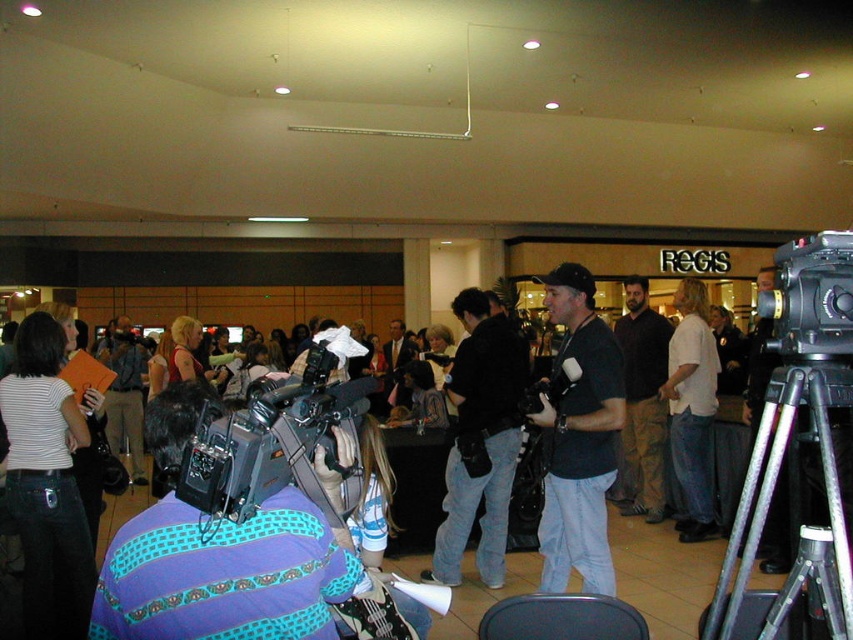
Question: Which of the following is the closest to the observer?

Choices:
 (A) (611, 474)
 (B) (776, 458)
 (C) (408, 396)
 (D) (212, 422)

Answer: (D)

Question: Which is farther from the black matte video camera at center?

Choices:
 (A) matte black shirt at center
 (B) dark brown leather pants at center
 (C) matte black camera at center

Answer: (C)

Question: Can you confirm if black plastic video camera at upper right is bigger than matte black camera at center?

Choices:
 (A) no
 (B) yes

Answer: (A)

Question: Considering the real-world distances, which object is closest to the dark brown leather pants at center?

Choices:
 (A) matte black camera at center
 (B) silver metallic tripod at lower right
 (C) white cotton shirt at center

Answer: (C)

Question: Can you confirm if matte black shirt at center is positioned to the left of dark brown leather pants at center?

Choices:
 (A) no
 (B) yes

Answer: (B)

Question: Is white cotton shirt at center closer to the viewer compared to silver metallic tripod at lower right?

Choices:
 (A) yes
 (B) no

Answer: (B)